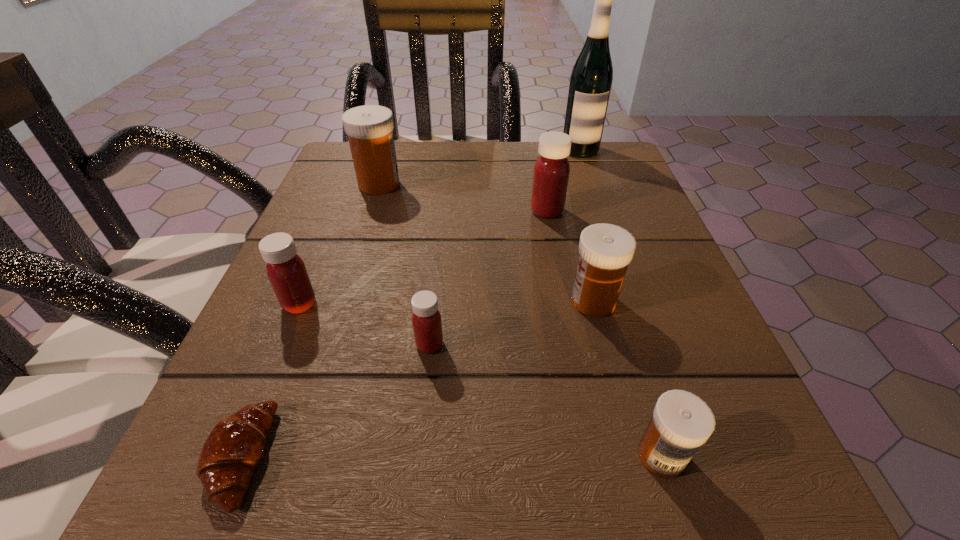
Locate which medicine ranks second in proximity to the second nearest red medicine. Please provide its 2D coordinates. Your answer should be formatted as a tuple, i.e. [(x, y)], where the tuple contains the x and y coordinates of a point satisfying the conditions above.

[(369, 128)]

Choose which white medicine is the nearest neighbor to the nearest white medicine. Please provide its 2D coordinates. Your answer should be formatted as a tuple, i.e. [(x, y)], where the tuple contains the x and y coordinates of a point satisfying the conditions above.

[(605, 250)]

The image size is (960, 540). Identify the location of white medicine that is the second closest to the second nearest white medicine. (369, 128).

Point out which red medicine is positioned as the second nearest to the nearest red medicine. Please provide its 2D coordinates. Your answer should be formatted as a tuple, i.e. [(x, y)], where the tuple contains the x and y coordinates of a point satisfying the conditions above.

[(551, 173)]

Where is `red medicine that is the third closest to the brown crescent roll`? The image size is (960, 540). red medicine that is the third closest to the brown crescent roll is located at coordinates (551, 173).

The height and width of the screenshot is (540, 960). In order to click on vacant space that satisfies the following two spatial constraints: 1. on the back side of the farthest red medicine; 2. on the right side of the shortest object in this screenshot , I will do `click(340, 211)`.